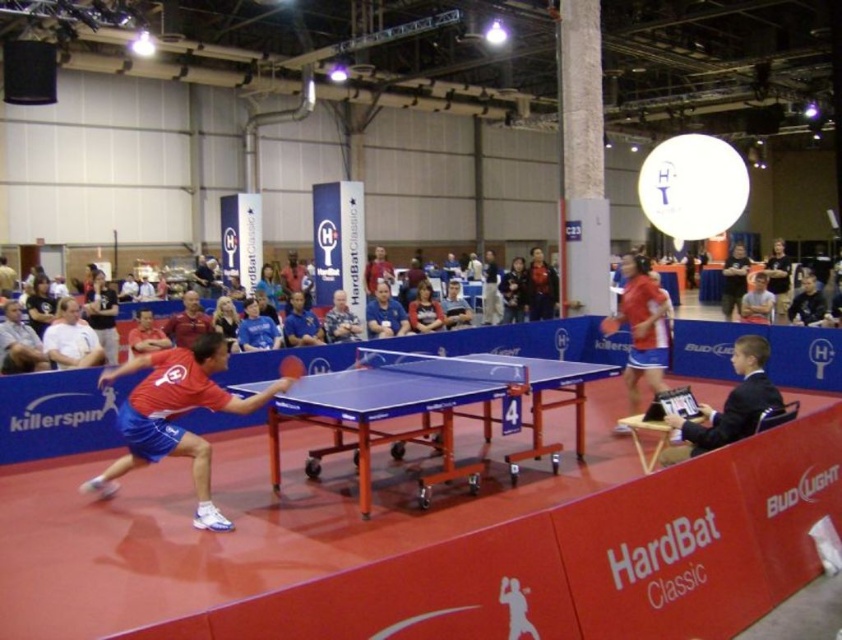
You are a spectator standing at the back of the hall and want to take a photo of the matte red shirt at left and the blue glossy table tennis table at center. Which object will appear larger in your photo?

The matte red shirt at left will appear larger in the photo because it is taller than the blue glossy table tennis table at center.

You are a spectator at the table tennis match and want to know which of the two points, point [185,352] or point [286,372], is closer to you. Can you determine this based on their positions?

Point [185,352] is closer to the viewer than point [286,372].

You are a spectator at the table tennis match. You want to place a small camera on the edge of the blue plastic table tennis table at center to capture the action. Considering the size of the matte red shirt at center worn by the player, will there be enough space on the table to securely mount the camera without it being obstructed by the shirt?

The blue plastic table tennis table at center has a larger size compared to the matte red shirt at center, so there should be sufficient space on the table to place the camera without obstruction from the shirt.